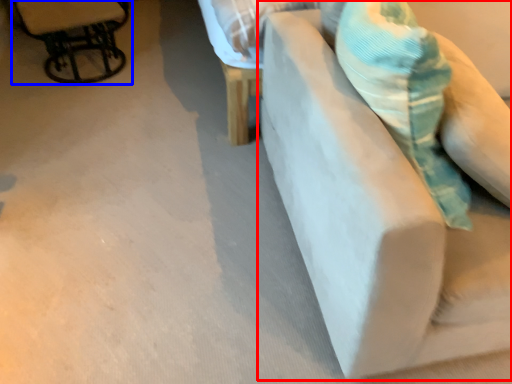
Question: Which object appears closest to the camera in this image, furniture (highlighted by a red box) or chair (highlighted by a blue box)?

Choices:
 (A) furniture
 (B) chair

Answer: (A)